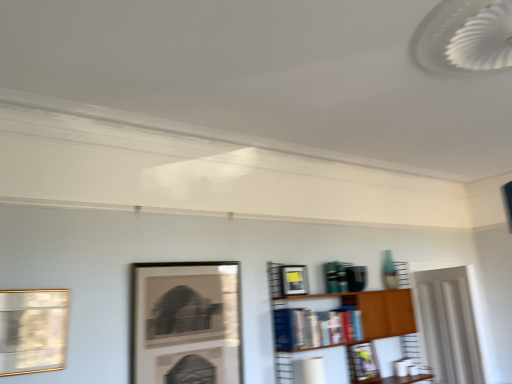
Question: In the image, is wooden bookshelf at center-right positioned in front of or behind matte black picture frame at upper center, placed as the first picture frame when sorted from back to front?

Choices:
 (A) front
 (B) behind

Answer: (A)

Question: From the image's perspective, is wooden bookshelf at center-right positioned above or below matte black picture frame at upper center, placed as the first picture frame when sorted from back to front?

Choices:
 (A) below
 (B) above

Answer: (B)

Question: Which object is positioned closest to the matte black picture frame at upper center, which is the 1th picture frame in right-to-left order?

Choices:
 (A) hardcover books at center
 (B) wooden bookshelf at center-right
 (C) matte black picture frame at upper center, which is counted as the second picture frame, starting from the back
 (D) matte black picture frame at center, which appears as the third picture frame when viewed from the back
 (E) gold-framed picture at left, positioned as the first picture frame in left-to-right order

Answer: (B)

Question: Estimate the real-world distances between objects in this image. Which object is farther from the matte black picture frame at upper center, which is the fourth picture frame in left-to-right order?

Choices:
 (A) hardcover books at center
 (B) gold-framed picture at left, which is the 4th picture frame from right to left
 (C) matte black picture frame at center, which appears as the 2th picture frame when viewed from the front
 (D) wooden bookshelf at center-right
 (E) matte black picture frame at upper center, the second picture frame positioned from the right

Answer: (B)